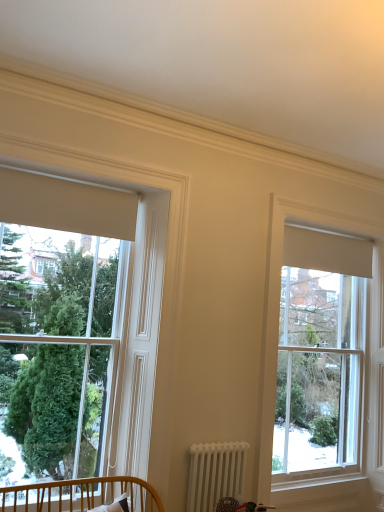
Question: Does clear glass window at upper right, which ranks as the first window in right-to-left order, come in front of white metallic radiator at lower center?

Choices:
 (A) no
 (B) yes

Answer: (A)

Question: Considering the relative sizes of clear glass window at upper right, which ranks as the first window in right-to-left order, and white metallic radiator at lower center in the image provided, is clear glass window at upper right, which ranks as the first window in right-to-left order, shorter than white metallic radiator at lower center?

Choices:
 (A) yes
 (B) no

Answer: (B)

Question: Is clear glass window at upper right, the 1th window when ordered from back to front, far from white metallic radiator at lower center?

Choices:
 (A) no
 (B) yes

Answer: (B)

Question: Is clear glass window at upper right, the second window viewed from the front, to the left of white metallic radiator at lower center from the viewer's perspective?

Choices:
 (A) no
 (B) yes

Answer: (A)

Question: Is clear glass window at upper right, the 1th window when ordered from back to front, behind white metallic radiator at lower center?

Choices:
 (A) yes
 (B) no

Answer: (A)

Question: Is clear glass window at upper right, the second window viewed from the front, wider than white metallic radiator at lower center?

Choices:
 (A) no
 (B) yes

Answer: (B)

Question: Is matte white window at left, which is the second window in back-to-front order, bigger than wooden crib at lower left?

Choices:
 (A) yes
 (B) no

Answer: (A)

Question: Considering the relative sizes of matte white window at left, which ranks as the 1th window in left-to-right order, and wooden crib at lower left in the image provided, is matte white window at left, which ranks as the 1th window in left-to-right order, shorter than wooden crib at lower left?

Choices:
 (A) yes
 (B) no

Answer: (B)

Question: Can you confirm if matte white window at left, acting as the 1th window starting from the front, is wider than wooden crib at lower left?

Choices:
 (A) yes
 (B) no

Answer: (B)

Question: Is matte white window at left, acting as the 1th window starting from the front, not within wooden crib at lower left?

Choices:
 (A) yes
 (B) no

Answer: (A)

Question: Considering the relative sizes of matte white window at left, acting as the 1th window starting from the front, and wooden crib at lower left in the image provided, is matte white window at left, acting as the 1th window starting from the front, smaller than wooden crib at lower left?

Choices:
 (A) no
 (B) yes

Answer: (A)

Question: Is there a large distance between matte white window at left, which is the second window in back-to-front order, and wooden crib at lower left?

Choices:
 (A) no
 (B) yes

Answer: (A)

Question: Considering the relative positions of white metallic radiator at lower center and wooden crib at lower left in the image provided, is white metallic radiator at lower center in front of wooden crib at lower left?

Choices:
 (A) no
 (B) yes

Answer: (A)